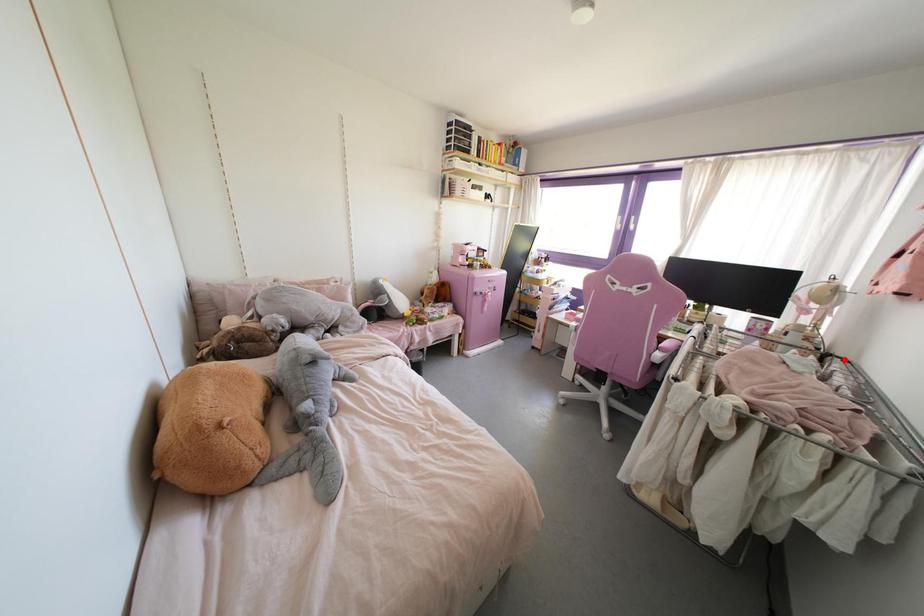
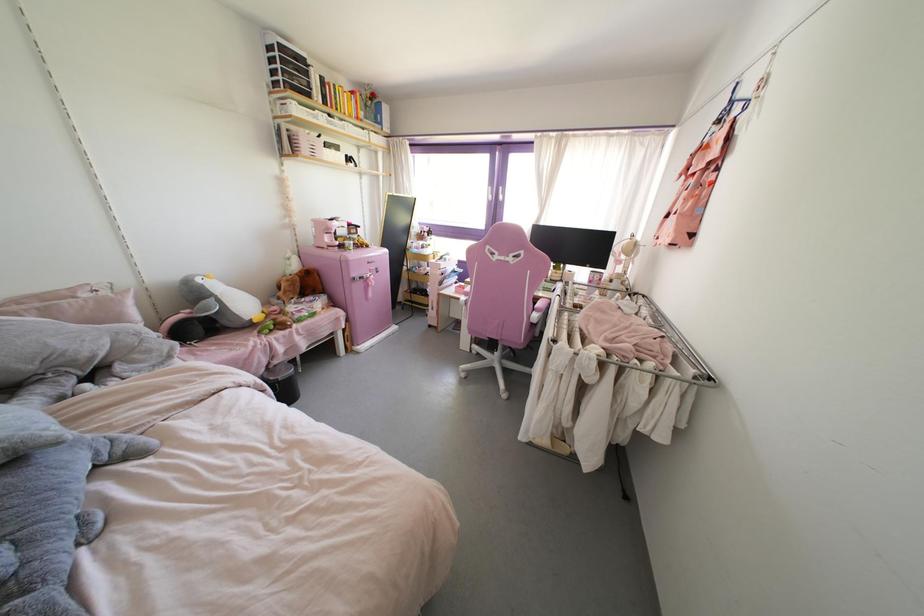
Question: I am providing you with two images of the same scene from different viewpoints. In image1, a red point is highlighted. Considering the same 3D point in image2, which of the following is correct?

Choices:
 (A) It is closer
 (B) It is farther

Answer: (A)